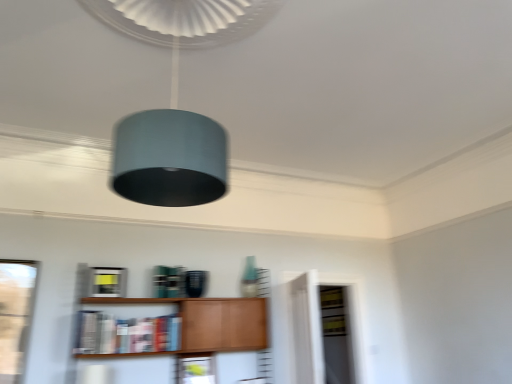
Question: From a real-world perspective, is wooden shelf at lower center above or below teal fabric lampshade at upper center?

Choices:
 (A) above
 (B) below

Answer: (B)

Question: Is point (187, 340) closer or farther from the camera than point (245, 31)?

Choices:
 (A) farther
 (B) closer

Answer: (A)

Question: Estimate the real-world distances between objects in this image. Which object is farther from the wooden shelf at lower center?

Choices:
 (A) matte wood cabinet at lower center
 (B) teal fabric lampshade at upper center
 (C) hardcover book at center
 (D) transparent glass door at center

Answer: (B)

Question: Considering the real-world distances, which object is closest to the wooden shelf at lower center?

Choices:
 (A) transparent glass door at center
 (B) hardcover book at center
 (C) teal fabric lampshade at upper center
 (D) matte wood cabinet at lower center

Answer: (B)